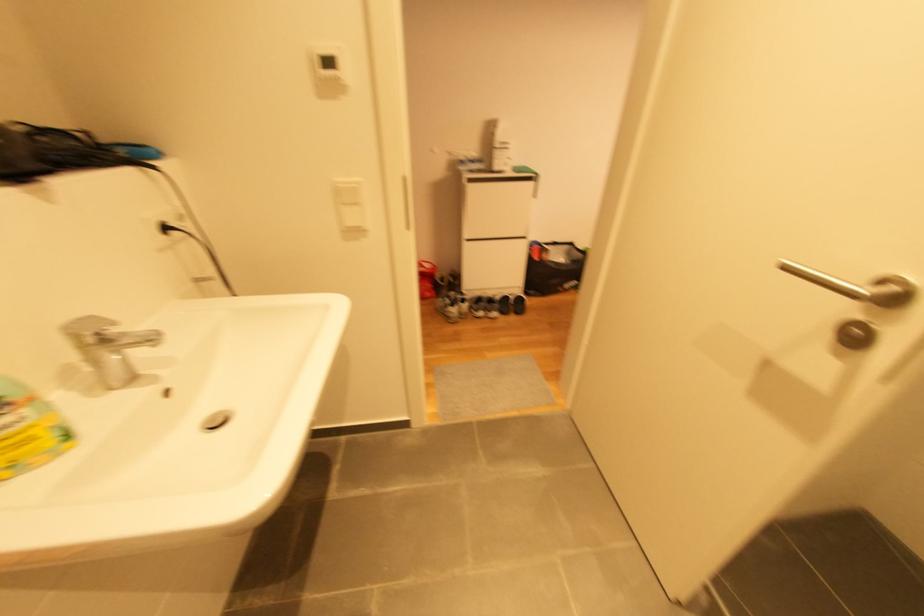
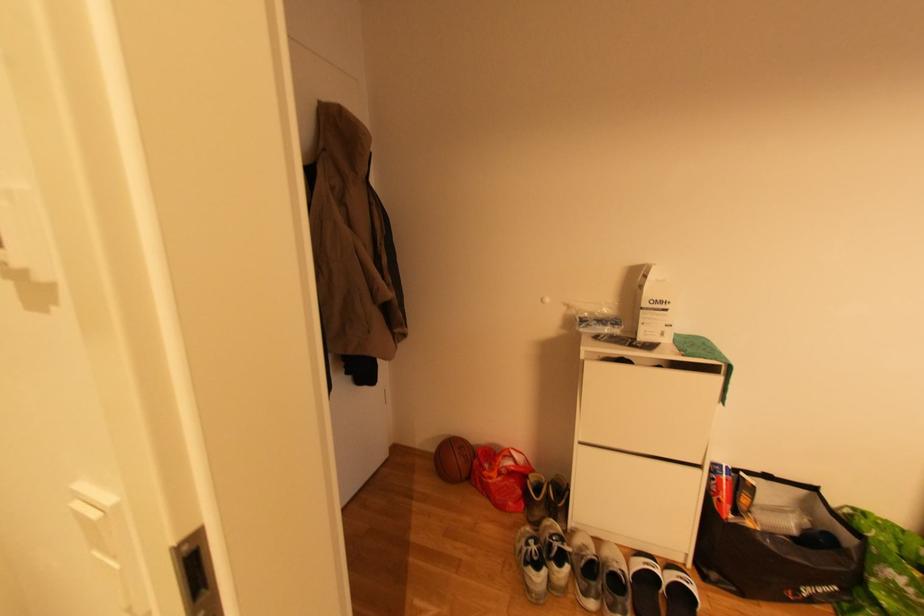
Question: The camera is either moving clockwise (left) or counter-clockwise (right) around the object. The first image is from the beginning of the video and the second image is from the end. Is the camera moving left or right when shooting the video?

Choices:
 (A) Left
 (B) Right

Answer: (B)